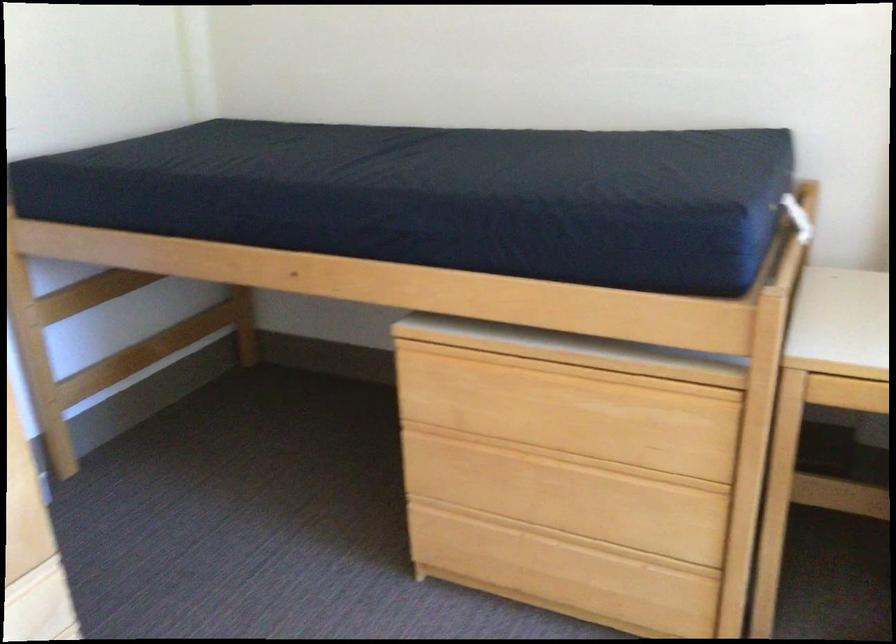
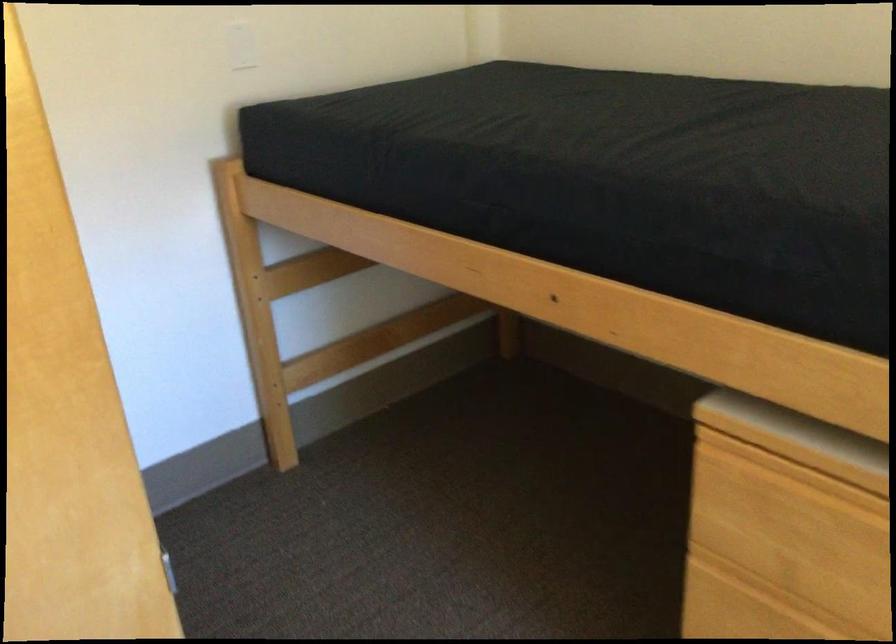
Question: The camera is either moving clockwise (left) or counter-clockwise (right) around the object. The first image is from the beginning of the video and the second image is from the end. Is the camera moving left or right when shooting the video?

Choices:
 (A) Left
 (B) Right

Answer: (B)